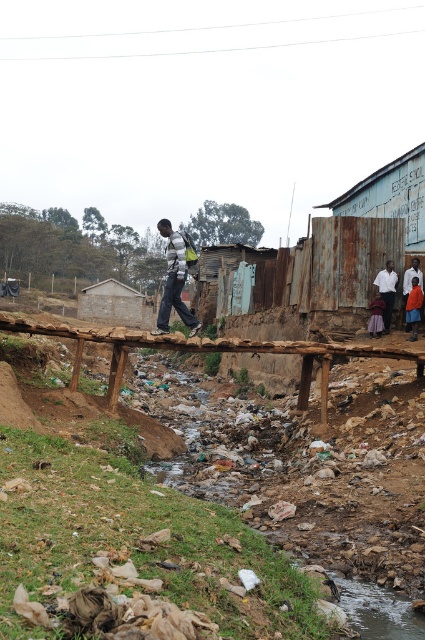
Question: Does white shirt at right have a lesser width compared to purple fabric skirt at center?

Choices:
 (A) no
 (B) yes

Answer: (A)

Question: Is striped sweater at center wider than white shirt at right?

Choices:
 (A) no
 (B) yes

Answer: (B)

Question: Which of the following is the closest to the observer?

Choices:
 (A) (379, 300)
 (B) (113, 410)
 (C) (379, 285)
 (D) (164, 307)

Answer: (D)

Question: Among these points, which one is nearest to the camera?

Choices:
 (A) (167, 310)
 (B) (172, 340)
 (C) (421, 291)
 (D) (377, 280)

Answer: (A)

Question: Which point is farther to the camera?

Choices:
 (A) (413, 285)
 (B) (186, 342)
 (C) (173, 294)

Answer: (A)

Question: Can you confirm if striped sweater at center is positioned below orange fabric skirt at lower right?

Choices:
 (A) no
 (B) yes

Answer: (A)